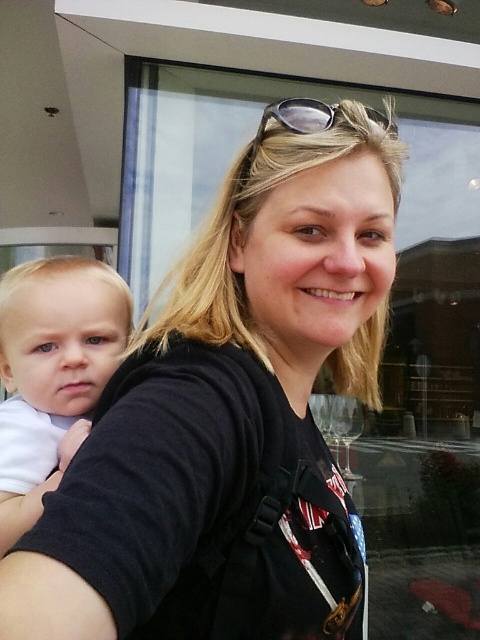
Question: Which object appears farthest from the camera in this image?

Choices:
 (A) sunglasses at center
 (B) black matte shirt at center

Answer: (A)

Question: Considering the relative positions of black matte shirt at center and white soft baby at left in the image provided, where is black matte shirt at center located with respect to white soft baby at left?

Choices:
 (A) above
 (B) below

Answer: (B)

Question: Does black matte shirt at center have a smaller size compared to white soft baby at left?

Choices:
 (A) yes
 (B) no

Answer: (B)

Question: Among these points, which one is nearest to the camera?

Choices:
 (A) (40, 317)
 (B) (286, 115)
 (C) (110, 392)

Answer: (C)

Question: Is black matte shirt at center further to camera compared to sunglasses at center?

Choices:
 (A) no
 (B) yes

Answer: (A)

Question: Which point is farther from the camera taking this photo?

Choices:
 (A) (256, 148)
 (B) (72, 266)

Answer: (B)